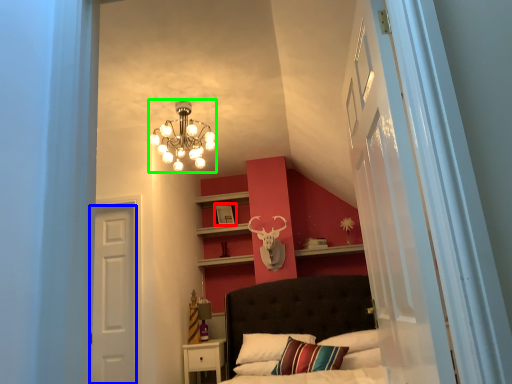
Question: Estimate the real-world distances between objects in this image. Which object is farther from picture frame (highlighted by a red box), door (highlighted by a blue box) or lamp (highlighted by a green box)?

Choices:
 (A) door
 (B) lamp

Answer: (A)